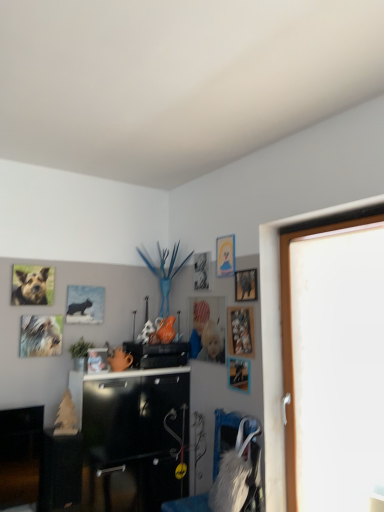
Question: From the image's perspective, does black matte speaker at center appear higher than matte plastic picture frame at center, arranged as the fifth picture frame when viewed from the right?

Choices:
 (A) no
 (B) yes

Answer: (A)

Question: Does black matte speaker at center have a larger size compared to matte plastic picture frame at center, the fourth picture frame in the left-to-right sequence?

Choices:
 (A) no
 (B) yes

Answer: (B)

Question: Can you confirm if black matte speaker at center is taller than matte plastic picture frame at center, arranged as the fifth picture frame when viewed from the right?

Choices:
 (A) no
 (B) yes

Answer: (A)

Question: Can you see black matte speaker at center touching matte plastic picture frame at center, the fourth picture frame in the left-to-right sequence?

Choices:
 (A) yes
 (B) no

Answer: (B)

Question: Would you say matte plastic picture frame at center, the fourth picture frame in the left-to-right sequence, is part of black matte speaker at center's contents?

Choices:
 (A) yes
 (B) no

Answer: (B)

Question: Considering the relative sizes of black matte speaker at center and matte plastic picture frame at center, the fourth picture frame in the left-to-right sequence, in the image provided, is black matte speaker at center wider than matte plastic picture frame at center, the fourth picture frame in the left-to-right sequence,?

Choices:
 (A) yes
 (B) no

Answer: (A)

Question: Does white furry swivel chair at center lie behind wooden picture frame at upper right, which ranks as the seventh picture frame in left-to-right order?

Choices:
 (A) no
 (B) yes

Answer: (A)

Question: Is white furry swivel chair at center facing away from wooden picture frame at upper right, which ranks as the seventh picture frame in left-to-right order?

Choices:
 (A) no
 (B) yes

Answer: (A)

Question: Would you consider white furry swivel chair at center to be distant from wooden picture frame at upper right, which ranks as the seventh picture frame in left-to-right order?

Choices:
 (A) no
 (B) yes

Answer: (A)

Question: Can you confirm if white furry swivel chair at center is positioned to the left of wooden picture frame at upper right, which ranks as the seventh picture frame in left-to-right order?

Choices:
 (A) no
 (B) yes

Answer: (B)

Question: Is white furry swivel chair at center bigger than wooden picture frame at upper right, which ranks as the seventh picture frame in left-to-right order?

Choices:
 (A) yes
 (B) no

Answer: (A)

Question: From the image's perspective, is white furry swivel chair at center located beneath wooden picture frame at upper right, which is the 2th picture frame from right to left?

Choices:
 (A) yes
 (B) no

Answer: (A)

Question: Is metallic silver picture frame at center, placed as the second picture frame when sorted from left to right, thinner than metallic silver photo frame at upper center, positioned as the 3th picture frame in left-to-right order?

Choices:
 (A) no
 (B) yes

Answer: (A)